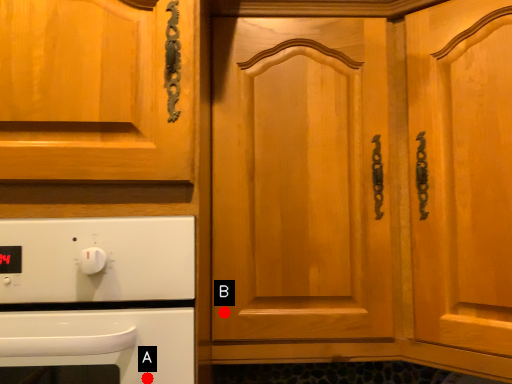
Question: Two points are circled on the image, labeled by A and B beside each circle. Among these points, which one is farthest from the camera?

Choices:
 (A) A is further
 (B) B is further

Answer: (B)